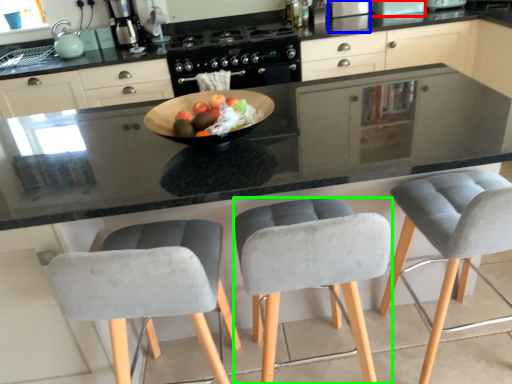
Question: Based on their relative distances, which object is nearer to appliance (highlighted by a red box)? Choose from appliance (highlighted by a blue box) and chair (highlighted by a green box).

Choices:
 (A) appliance
 (B) chair

Answer: (A)